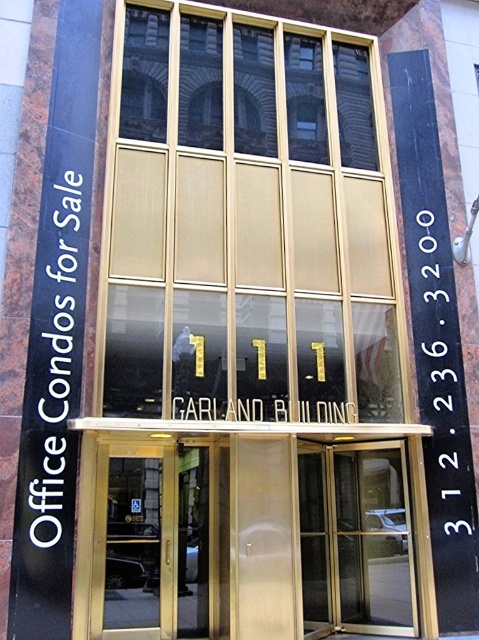
You are a delivery person with a large package that measures 5 feet in width. You need to enter the 111 Garland Building through either the gold metallic doors at center or the transparent glass door at center. Can you fit through the space between these two doors?

The gold metallic doors at center and transparent glass door at center are 5.20 feet apart, so the package measuring 5 feet in width can fit through the space between them since it is slightly narrower than the available space.

You are a visitor approaching the entrance of the 111 Garland Building. You see the gold metallic doors at center and the gold glass doors at center. Which set of doors is located higher up?

The gold metallic doors at center are positioned over the gold glass doors at center, so they are higher up.

In the scene shown: What is the spatial relationship between the gold metallic doors at center and the transparent glass door at center in the entrance of the 111 Garland Building?

The gold metallic doors at center are located above the transparent glass door at center, meaning the gold doors are positioned higher up on the facade compared to the transparent glass door.